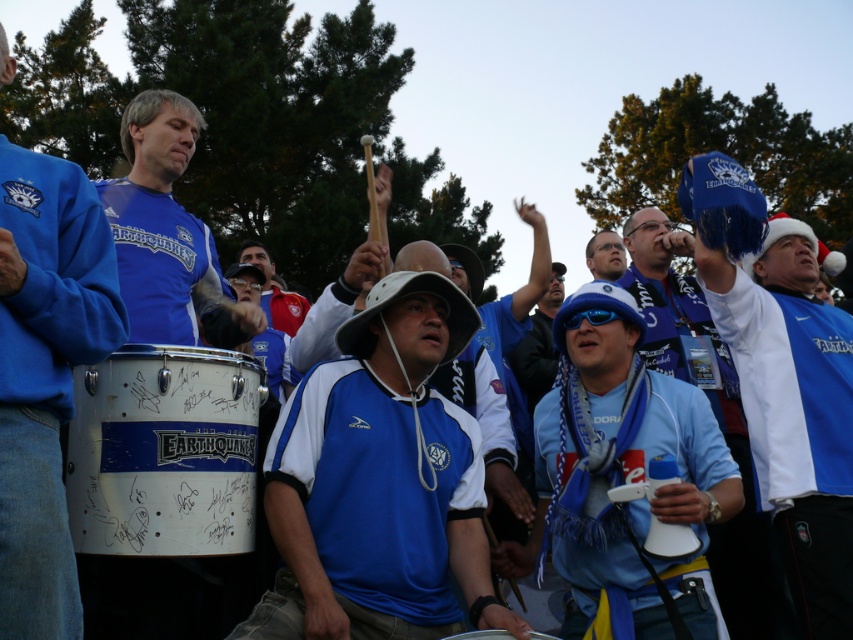
You are a photographer at the event and want to take a photo that includes both the matte blue jersey at center and the matte blue shirt at center. Which object should you focus on first to ensure both are in frame?

The matte blue jersey at center is much taller than the matte blue shirt at center, so you should focus on the matte blue jersey at center first to ensure it fits within the frame.